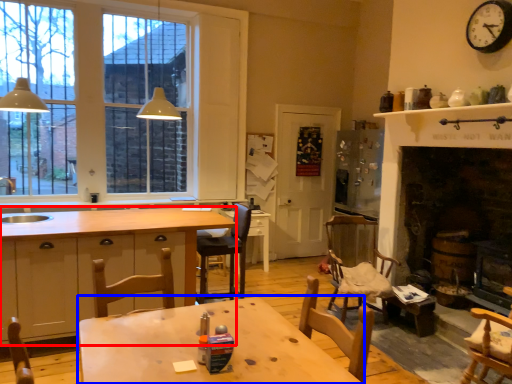
Question: Which object is further to the camera taking this photo, cabinetry (highlighted by a red box) or table (highlighted by a blue box)?

Choices:
 (A) cabinetry
 (B) table

Answer: (A)